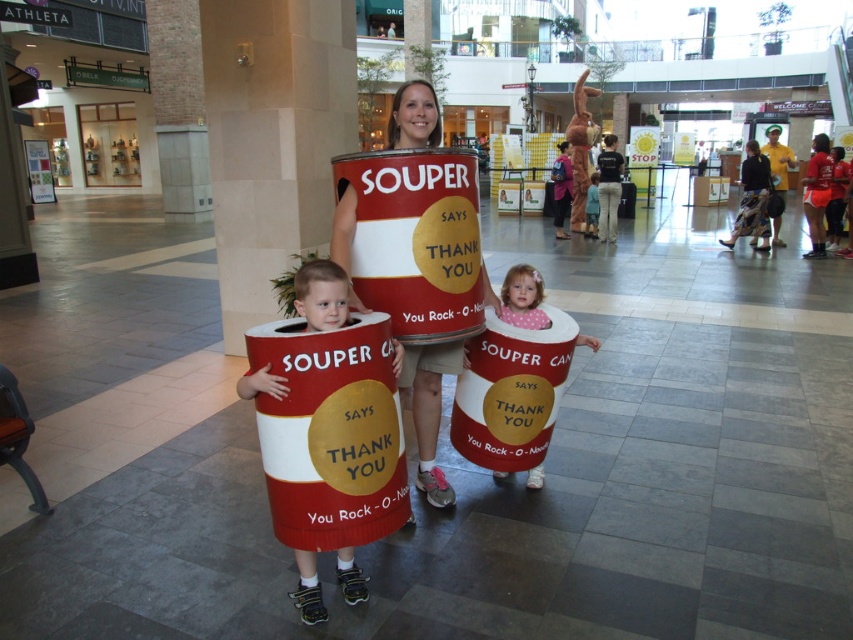
You are standing at the entrance of the mall and see two points in the scene. The first point is at coordinate point (283, 540) and the second is at point (496, 476). Which point is closer to you?

Point (283, 540) is closer to the camera than point (496, 476), so the first point is closer to you.

You are standing at the entrance of the mall and want to walk to the light blue fabric dress at center. However, there is a matte cardboard can at center in your path. Can you walk around it without getting too close? Explain your reasoning.

The matte cardboard can at center is 37.83 feet away from the light blue fabric dress at center. Since the distance between them is quite large, you can easily walk around the matte cardboard can at center while maintaining a safe distance from both objects.